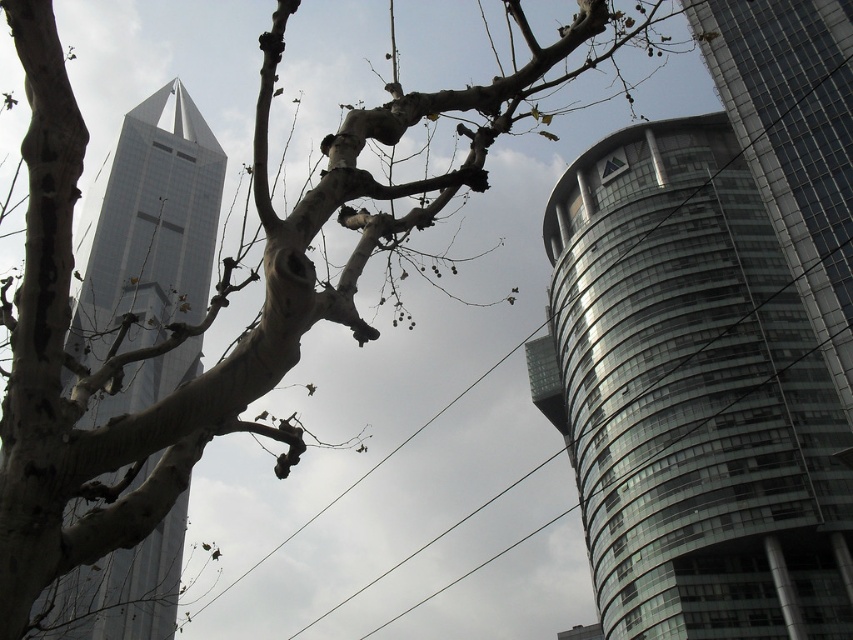
You are standing at the center of the image and want to locate the glassy reflective tower at center. According to the coordinates provided, in which direction should you look to find it?

The glassy reflective tower at center is located at coordinates point (714, 340). Since you are at the center, you should look downward to find it because the y coordinate 0.838 indicates it is below the center point.

You are standing at the center of the image and want to take a photo of the glassy reflective tower at center. Given that your camera has a field of view that can capture objects within a 100cm radius from your position, will the tower be fully within your camera frame?

The glassy reflective tower at center is located at point [714,340], which is within the 100cm radius of your position at the center. Therefore, the tower will be fully within your camera frame.

In the scene shown: You are an electrician inspecting the wires in the image. You see the transparent wire at upper center and the black wire at center. Which wire is positioned higher?

The transparent wire at upper center is positioned higher than the black wire at center.